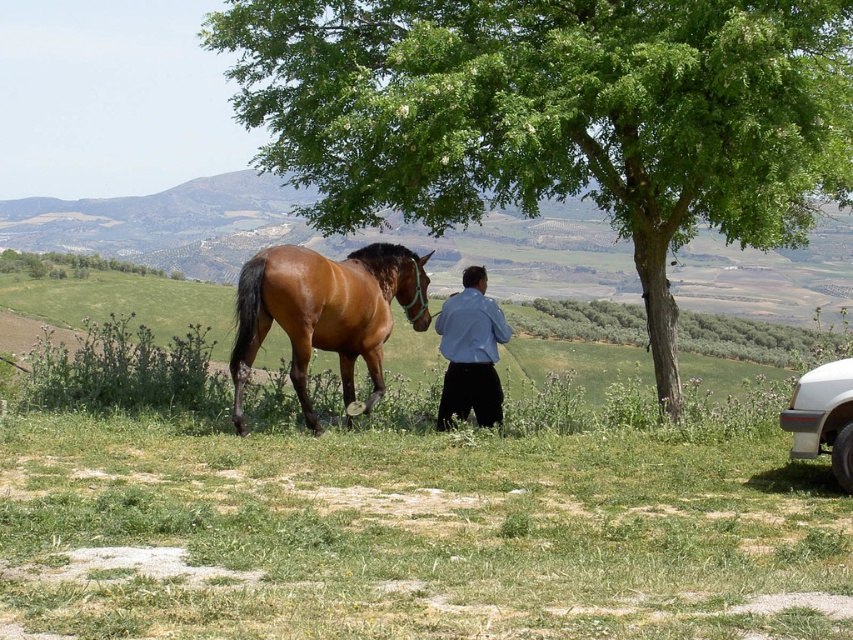
In the rural scene, you notice the blue smooth shirt at center and the green leafy tree at upper left. Which object takes up more area in the image?

The green leafy tree at upper left takes up more area in the image than the blue smooth shirt at center.

You are a photographer trying to capture a wide shot of the blue smooth shirt at center and the green leafy tree at upper left. Based on their sizes in the image, which one would appear smaller in the photo?

The blue smooth shirt at center appears smaller in the photo because it has a lesser width compared to the green leafy tree at upper left.